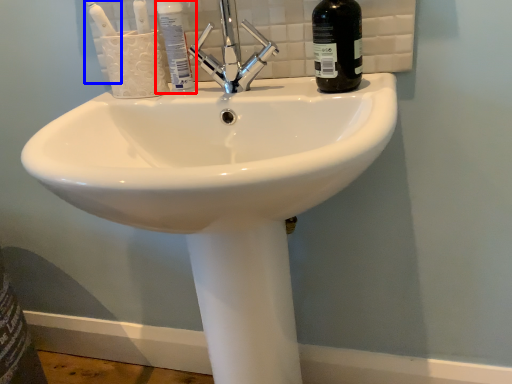
Question: Which of the following is the closest to the observer, mouthwash (highlighted by a red box) or toothbrush (highlighted by a blue box)?

Choices:
 (A) mouthwash
 (B) toothbrush

Answer: (B)